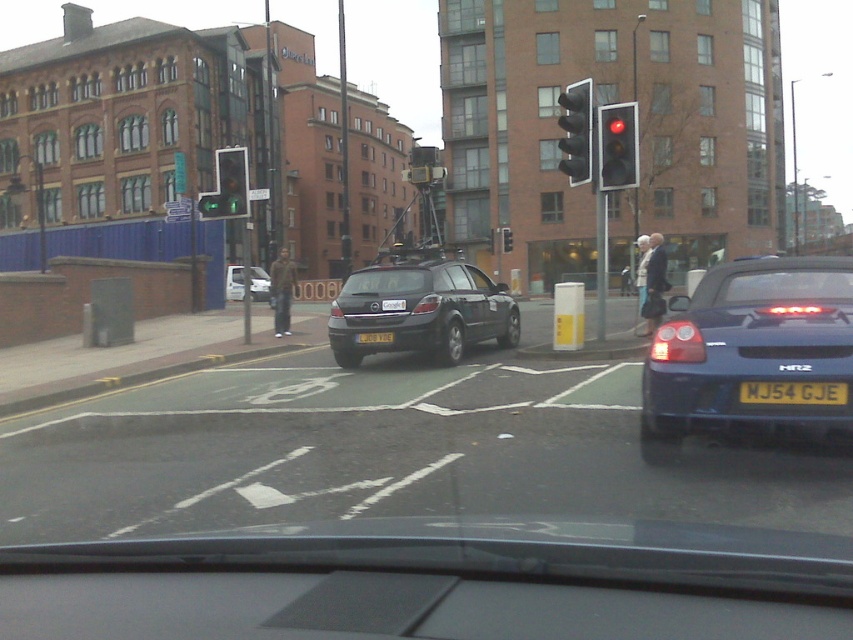
Is clear glass windshield at center below white glossy car at center?

Correct, clear glass windshield at center is located below white glossy car at center.

Between point (422, 269) and point (256, 289), which one is positioned in front?

Point (422, 269) is more forward.

Identify the location of clear glass windshield at center. The image size is (853, 640). (387, 282).

Find the location of `clear glass windshield at center`. clear glass windshield at center is located at coordinates (387, 282).

Does metallic traffic light at upper center come in front of yellow metallic license plate at center?

No, metallic traffic light at upper center is behind yellow metallic license plate at center.

Locate an element on the screen. metallic traffic light at upper center is located at coordinates (230, 184).

What are the coordinates of `metallic traffic light at upper center` in the screenshot? It's located at (230, 184).

Is transparent plastic windshield at center smaller than white glossy car at center?

Correct, transparent plastic windshield at center occupies less space than white glossy car at center.

Is transparent plastic windshield at center to the right of white glossy car at center from the viewer's perspective?

Indeed, transparent plastic windshield at center is positioned on the right side of white glossy car at center.

Which is behind, point (840, 268) or point (257, 282)?

The point (257, 282) is more distant.

I want to click on transparent plastic windshield at center, so click(787, 285).